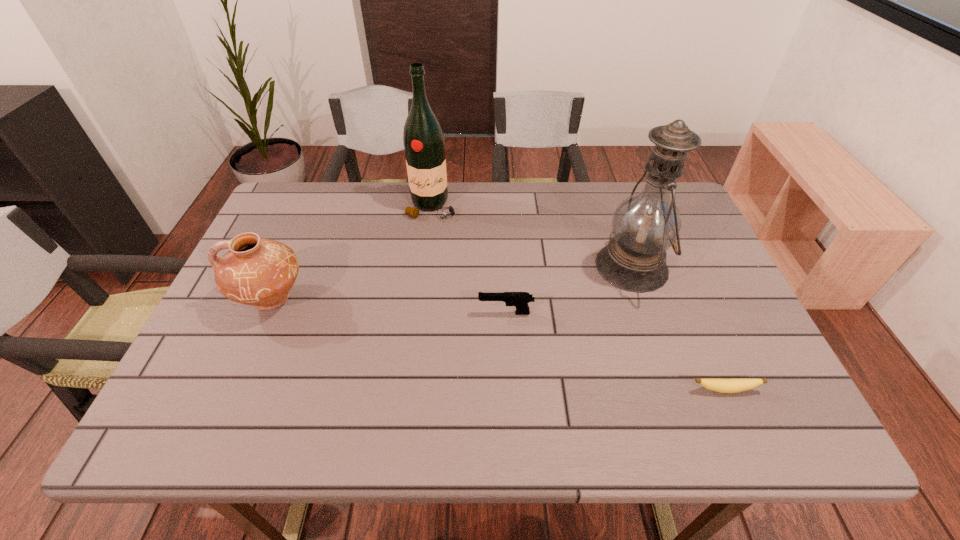
The image size is (960, 540). I want to click on blank area in the image that satisfies the following two spatial constraints: 1. on the surface of the oil lamp; 2. on the right side of the second object from left to right, so click(424, 266).

Where is `free space that satisfies the following two spatial constraints: 1. on the surface of the oil lamp; 2. on the left side of the second object from left to right`? This screenshot has width=960, height=540. free space that satisfies the following two spatial constraints: 1. on the surface of the oil lamp; 2. on the left side of the second object from left to right is located at coordinates (424, 266).